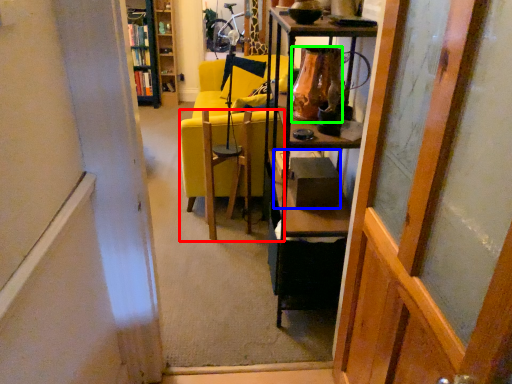
Question: Which object is the closest to the chair (highlighted by a red box)? Choose among these: box (highlighted by a blue box) or vase (highlighted by a green box).

Choices:
 (A) box
 (B) vase

Answer: (A)